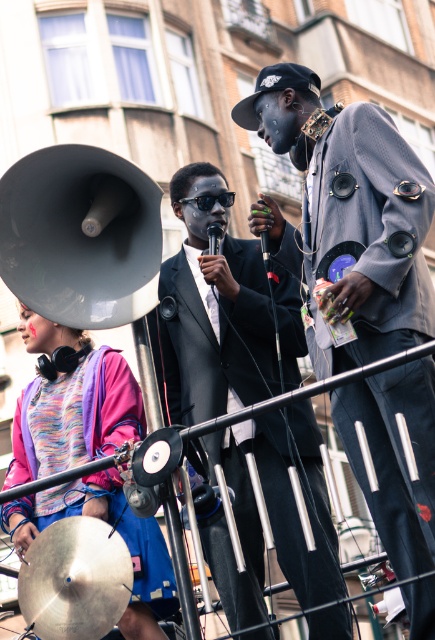
Can you confirm if shiny black suit at center is positioned to the right of multicolored fabric at lower left?

Correct, you'll find shiny black suit at center to the right of multicolored fabric at lower left.

Which is in front, point (315, 452) or point (32, 438)?

Positioned in front is point (315, 452).

At what (x,y) coordinates should I click in order to perform the action: click on shiny black suit at center. Please return your answer as a coordinate pair (x, y). The height and width of the screenshot is (640, 435). Looking at the image, I should click on (210, 310).

Between matte gray jacket at center and multicolored fabric at lower left, which one has less height?

Standing shorter between the two is multicolored fabric at lower left.

This screenshot has width=435, height=640. What do you see at coordinates (347, 216) in the screenshot? I see `matte gray jacket at center` at bounding box center [347, 216].

This screenshot has height=640, width=435. Find the location of `matte gray jacket at center`. matte gray jacket at center is located at coordinates (347, 216).

This screenshot has height=640, width=435. Describe the element at coordinates (347, 216) in the screenshot. I see `matte gray jacket at center` at that location.

Can you confirm if matte gray jacket at center is bigger than shiny silver cymbal at lower left?

Indeed, matte gray jacket at center has a larger size compared to shiny silver cymbal at lower left.

Which is behind, point (375, 266) or point (84, 570)?

Point (375, 266)

This screenshot has height=640, width=435. Identify the location of matte gray jacket at center. (347, 216).